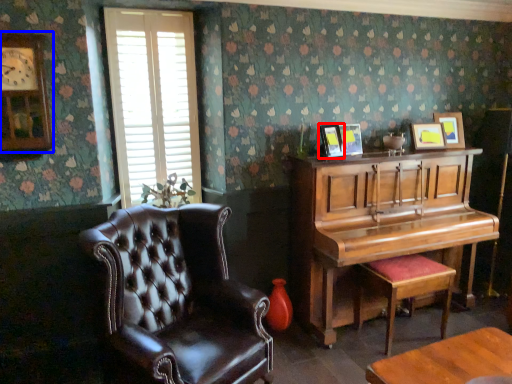
Question: Among these objects, which one is farthest to the camera, picture frame (highlighted by a red box) or clock (highlighted by a blue box)?

Choices:
 (A) picture frame
 (B) clock

Answer: (A)